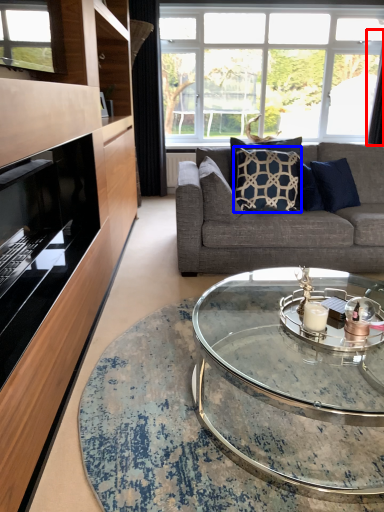
Question: Which object appears closest to the camera in this image, curtain (highlighted by a red box) or pillow (highlighted by a blue box)?

Choices:
 (A) curtain
 (B) pillow

Answer: (B)